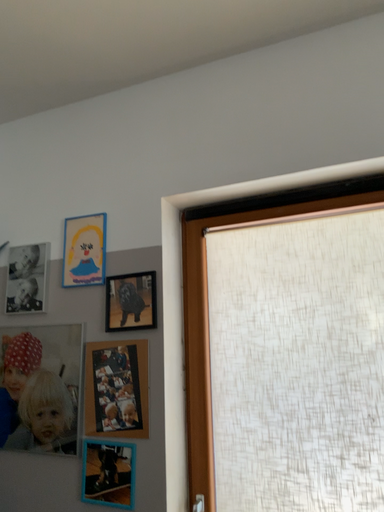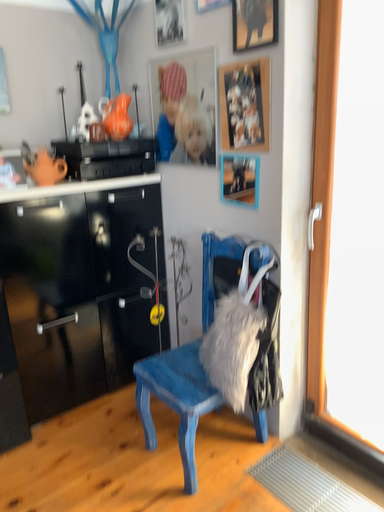
Question: Which way did the camera rotate in the video?

Choices:
 (A) rotated upward
 (B) rotated downward

Answer: (B)